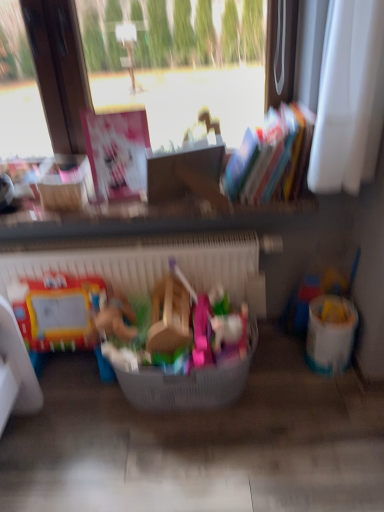
Question: Could you tell me if plastic basket at center is turned towards white plastic bucket at right?

Choices:
 (A) no
 (B) yes

Answer: (A)

Question: Is plastic basket at center smaller than white plastic bucket at right?

Choices:
 (A) yes
 (B) no

Answer: (B)

Question: From the image's perspective, is plastic basket at center on top of white plastic bucket at right?

Choices:
 (A) no
 (B) yes

Answer: (A)

Question: From a real-world perspective, does plastic basket at center stand above white plastic bucket at right?

Choices:
 (A) yes
 (B) no

Answer: (A)

Question: Does plastic basket at center have a lesser height compared to white plastic bucket at right?

Choices:
 (A) yes
 (B) no

Answer: (A)

Question: From a real-world perspective, is plastic basket at center located beneath white plastic bucket at right?

Choices:
 (A) yes
 (B) no

Answer: (B)

Question: Does white plastic bucket at right have a greater width compared to plastic basket at center, positioned as the second toy in right-to-left order?

Choices:
 (A) yes
 (B) no

Answer: (B)

Question: Does white plastic bucket at right come behind plastic basket at center, the 2th toy viewed from the back?

Choices:
 (A) yes
 (B) no

Answer: (A)

Question: Does white plastic bucket at right have a smaller size compared to plastic basket at center, which is counted as the first toy, starting from the front?

Choices:
 (A) yes
 (B) no

Answer: (A)

Question: From the image's perspective, would you say white plastic bucket at right is shown under plastic basket at center, the first toy in the left-to-right sequence?

Choices:
 (A) no
 (B) yes

Answer: (B)

Question: From a real-world perspective, does white plastic bucket at right stand above plastic basket at center, the 2th toy viewed from the back?

Choices:
 (A) no
 (B) yes

Answer: (A)

Question: Could plastic basket at center, which is counted as the first toy, starting from the front, be considered to be inside white plastic bucket at right?

Choices:
 (A) no
 (B) yes

Answer: (A)

Question: Can you confirm if translucent plastic bucket at right, the first toy viewed from the back, is positioned to the left of plastic basket at center, the 2th toy viewed from the back?

Choices:
 (A) no
 (B) yes

Answer: (A)